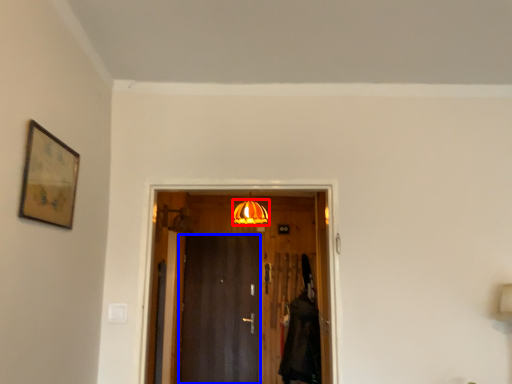
Question: Which object is closer to the camera taking this photo, lamp (highlighted by a red box) or door (highlighted by a blue box)?

Choices:
 (A) lamp
 (B) door

Answer: (A)